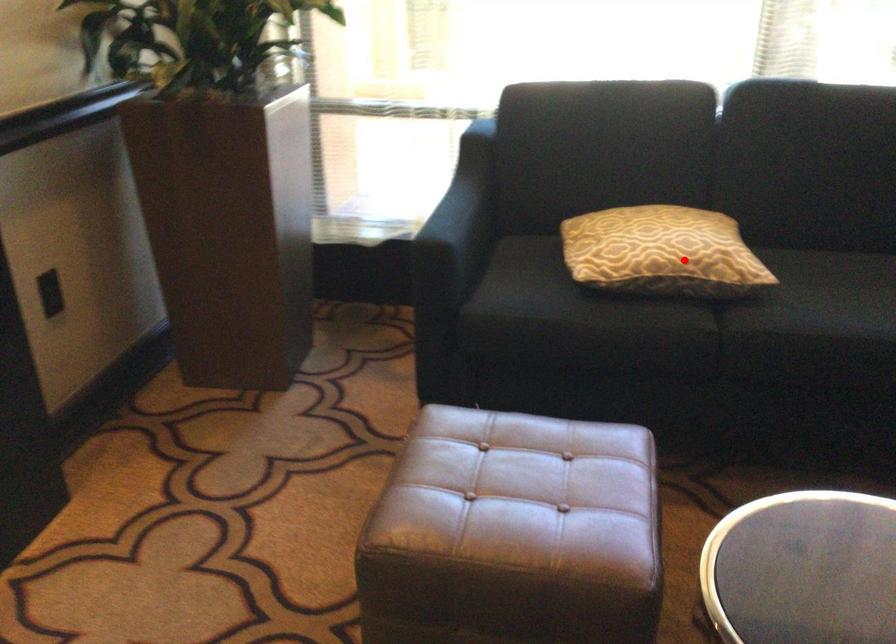
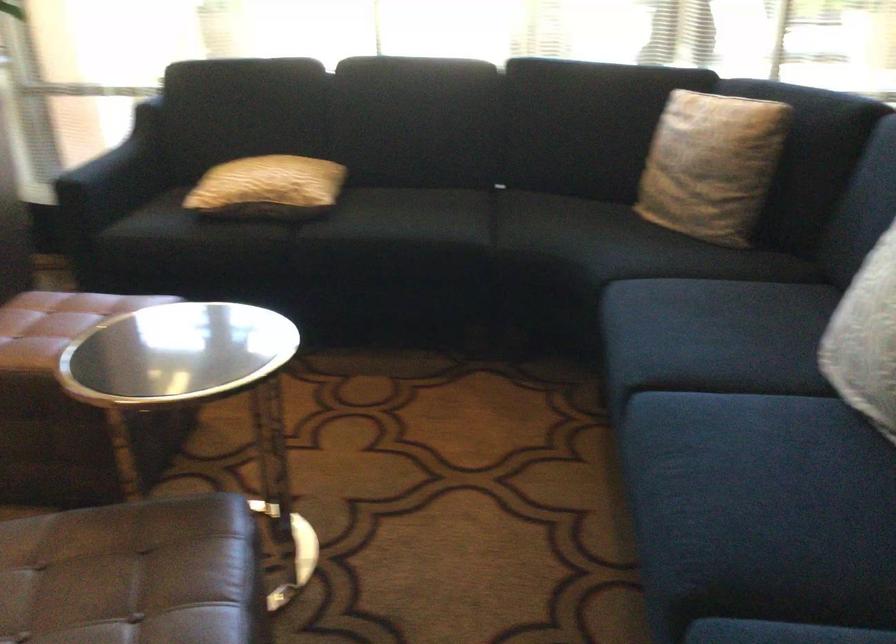
Where in the second image is the point corresponding to the highlighted location from the first image?

(268, 187)